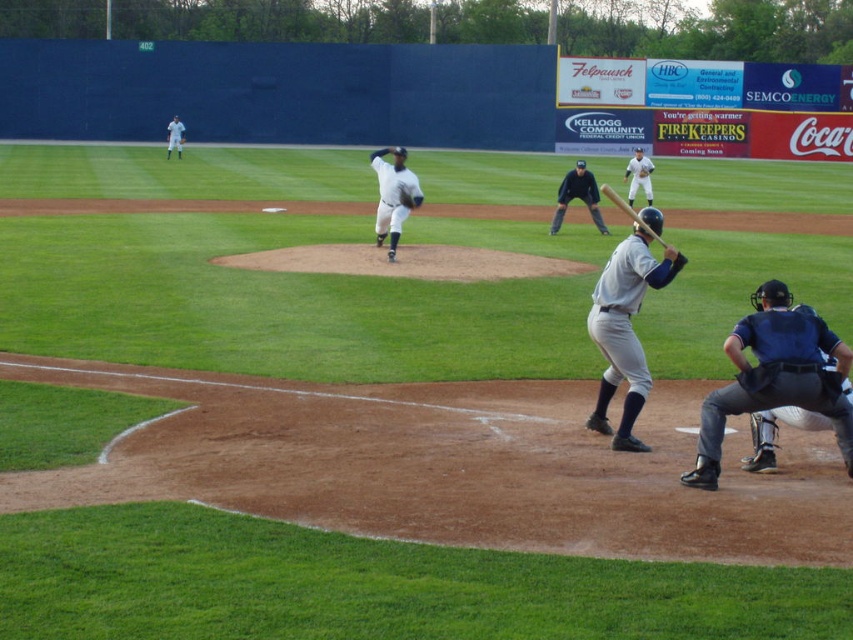
You are a photographer standing at the point marked as point (775, 376). You want to take a photo of the blue padded gear at lower right. Is the point on the gear?

Yes, the point (775, 376) is on the blue padded gear at lower right, so you can take the photo from that point.

You are a spectator at the baseball game and want to know if the blue padded gear at lower right can be placed inside the gray matte bat at center. Based on their sizes, is this possible?

The blue padded gear at lower right occupies less space than gray matte bat at center, so it cannot be placed inside the gray matte bat at center since the gear is smaller than the bat.